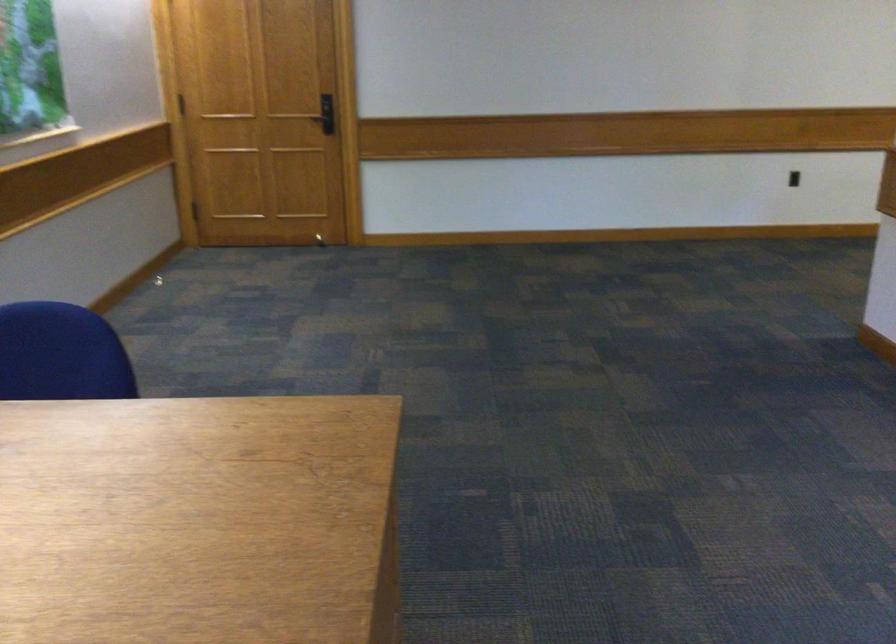
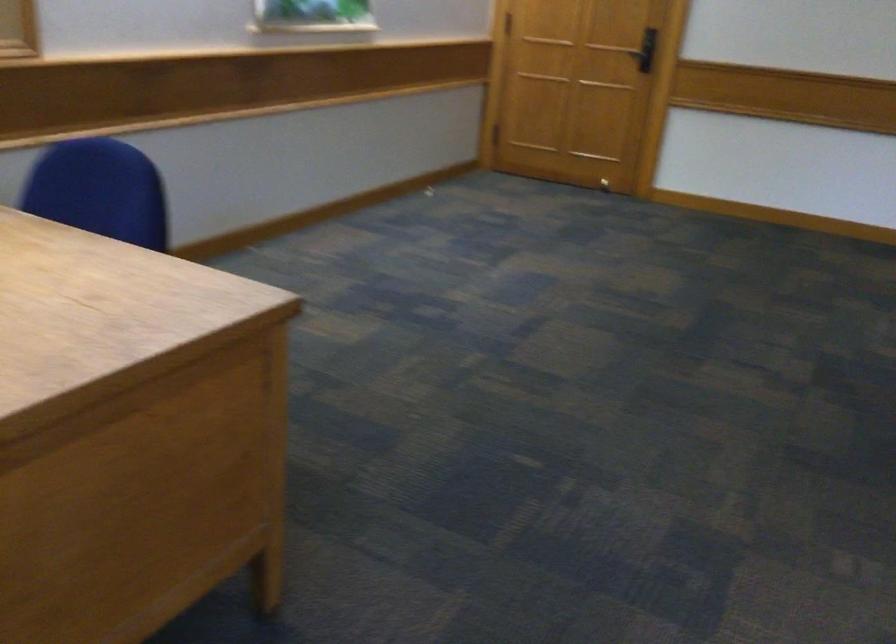
Question: How did the camera likely rotate?

Choices:
 (A) Left
 (B) Right
 (C) Up
 (D) Down

Answer: (A)